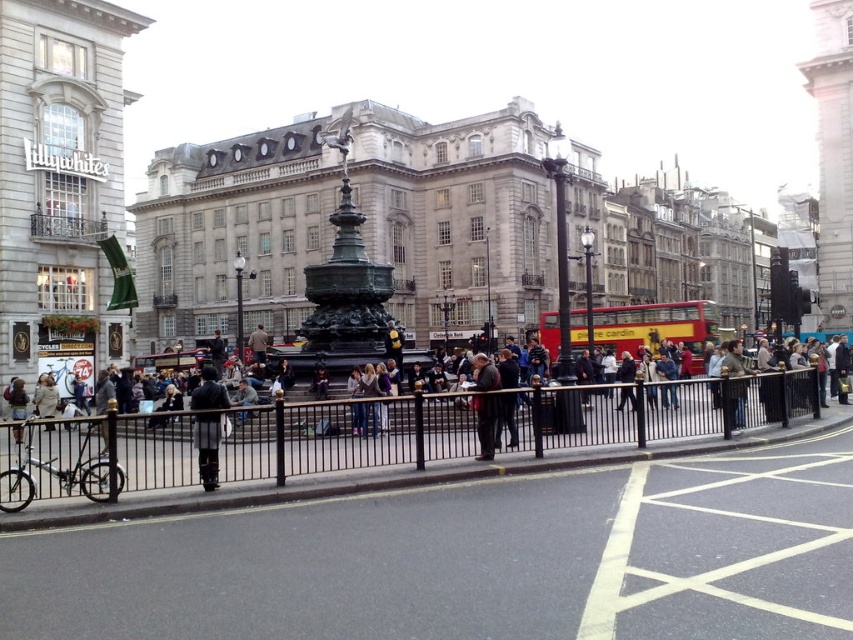
Measure the distance between red/yellow double-decker bus at center and camera.

They are 81.21 meters apart.

In the scene shown: Who is more forward, (552, 317) or (200, 438)?

Point (200, 438) is in front.

Does point (700, 339) come behind point (213, 388)?

Yes, point (700, 339) is farther from viewer.

Locate an element on the screen. This screenshot has height=640, width=853. red/yellow double-decker bus at center is located at coordinates (660, 326).

Which is in front, point (558, 404) or point (622, 316)?

Positioned in front is point (558, 404).

In the scene shown: Is black metal fence at lower center bigger than red/yellow double-decker bus at center?

Actually, black metal fence at lower center might be smaller than red/yellow double-decker bus at center.

Between point (589, 436) and point (592, 312), which one is positioned behind?

Positioned behind is point (592, 312).

This screenshot has height=640, width=853. I want to click on black metal fence at lower center, so click(297, 440).

Between dark gray fabric coat at center and dark gray suit at center, which one appears on the left side from the viewer's perspective?

dark gray fabric coat at center

Can you confirm if dark gray fabric coat at center is positioned above dark gray suit at center?

Incorrect, dark gray fabric coat at center is not positioned above dark gray suit at center.

Between point (207, 426) and point (479, 454), which one is positioned behind?

Point (479, 454)

The image size is (853, 640). In order to click on dark gray fabric coat at center in this screenshot , I will do `click(207, 448)`.